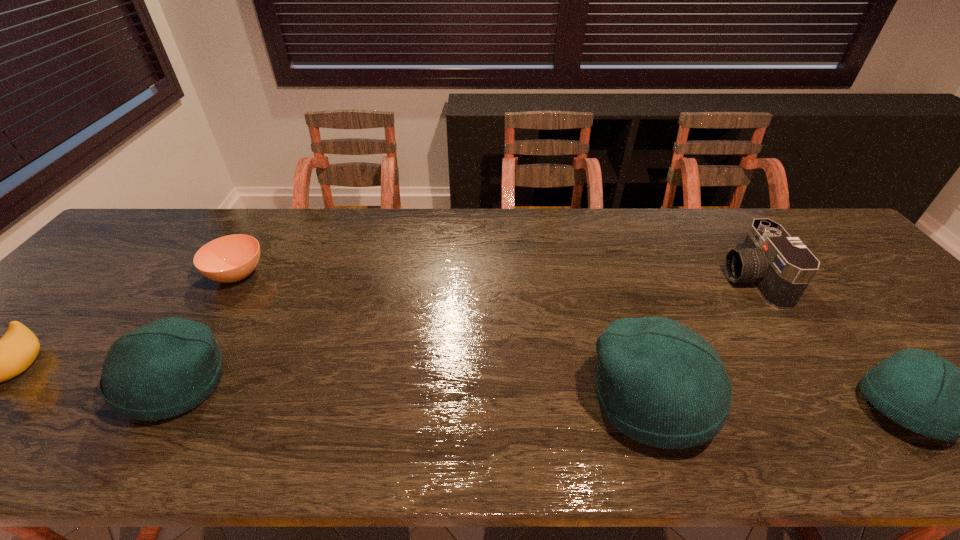
Please determine a free point for an extra beanie to ensure balance. Please provide its 2D coordinates. Your answer should be formatted as a tuple, i.e. [(x, y)], where the tuple contains the x and y coordinates of a point satisfying the conditions above.

[(411, 393)]